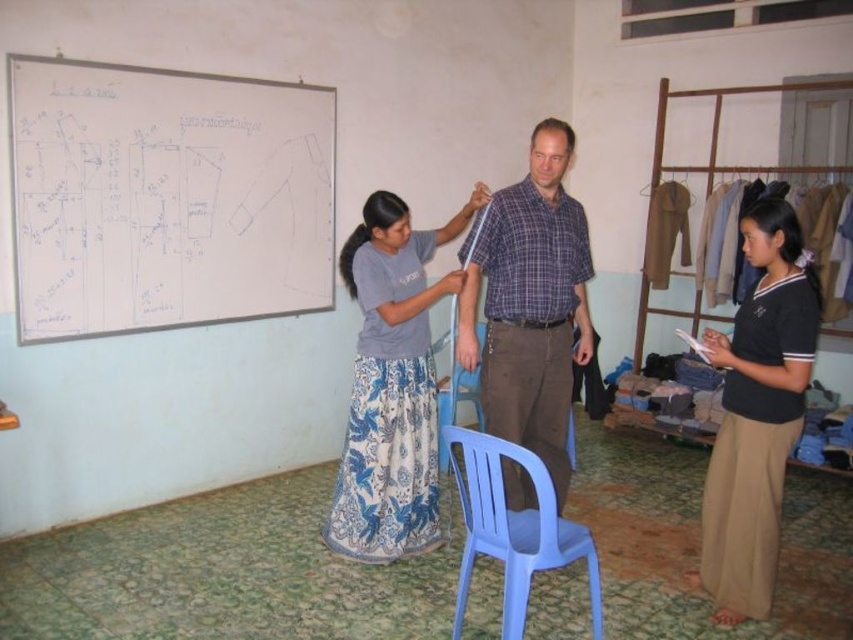
Question: Which point is closer to the camera?

Choices:
 (A) black cotton skirt at lower right
 (B) plaid cotton shirt at center

Answer: (A)

Question: From the image, what is the correct spatial relationship of blue plastic chair at lower center in relation to blue plastic chair at center?

Choices:
 (A) right
 (B) left

Answer: (A)

Question: Is plaid cotton shirt at center to the left of black cotton skirt at lower right from the viewer's perspective?

Choices:
 (A) yes
 (B) no

Answer: (A)

Question: Which of the following is the farthest from the observer?

Choices:
 (A) (569, 326)
 (B) (561, 564)
 (C) (756, 493)
 (D) (67, 90)

Answer: (D)

Question: Which object appears farthest from the camera in this image?

Choices:
 (A) blue floral skirt at center
 (B) white paperboard at upper left
 (C) blue plastic chair at center
 (D) black cotton skirt at lower right

Answer: (B)

Question: Does plaid cotton shirt at center appear on the right side of blue plastic chair at lower center?

Choices:
 (A) no
 (B) yes

Answer: (B)